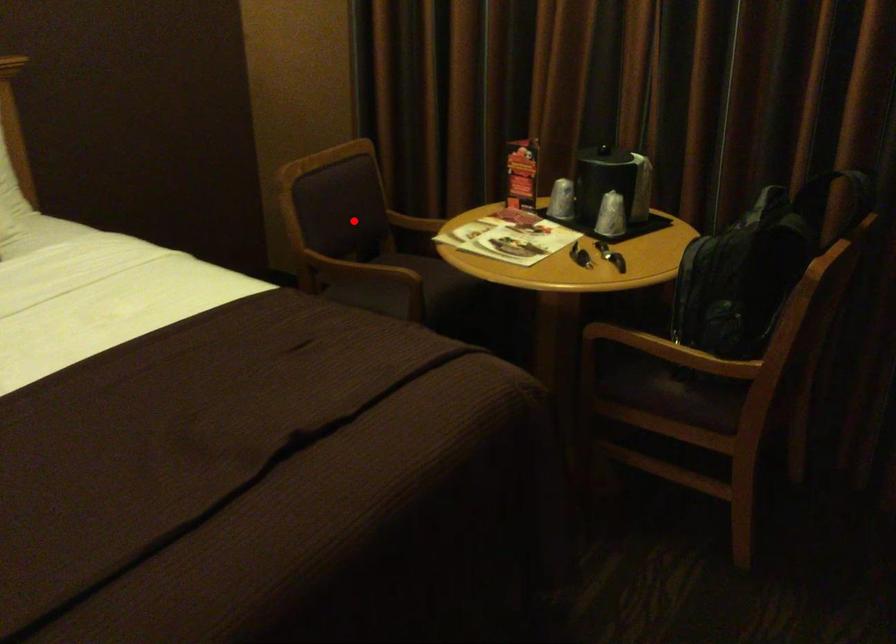
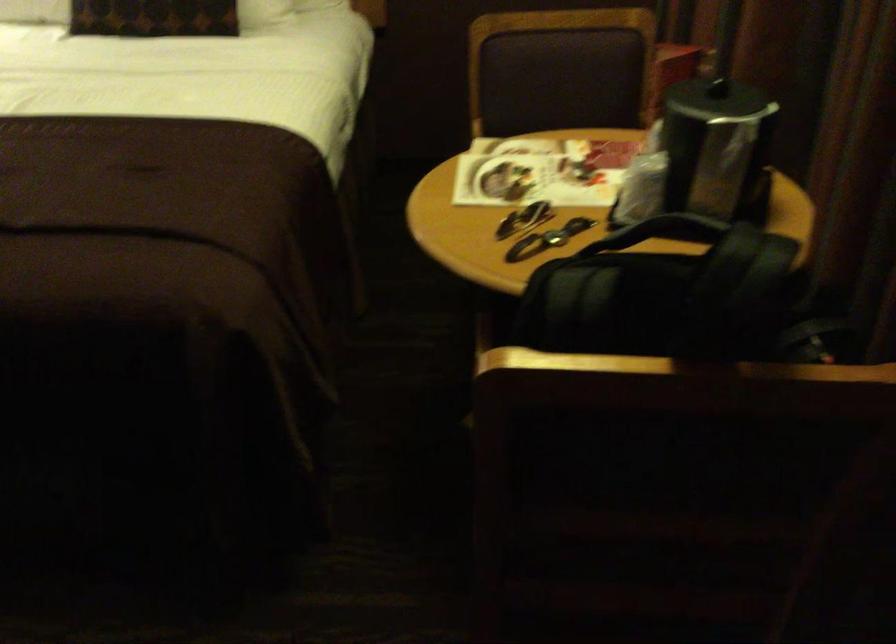
Question: I am providing you with two images of the same scene from different viewpoints. A red point is shown in image1. For the corresponding object point in image2, is it positioned nearer or farther from the camera?

Choices:
 (A) Nearer
 (B) Farther

Answer: (A)